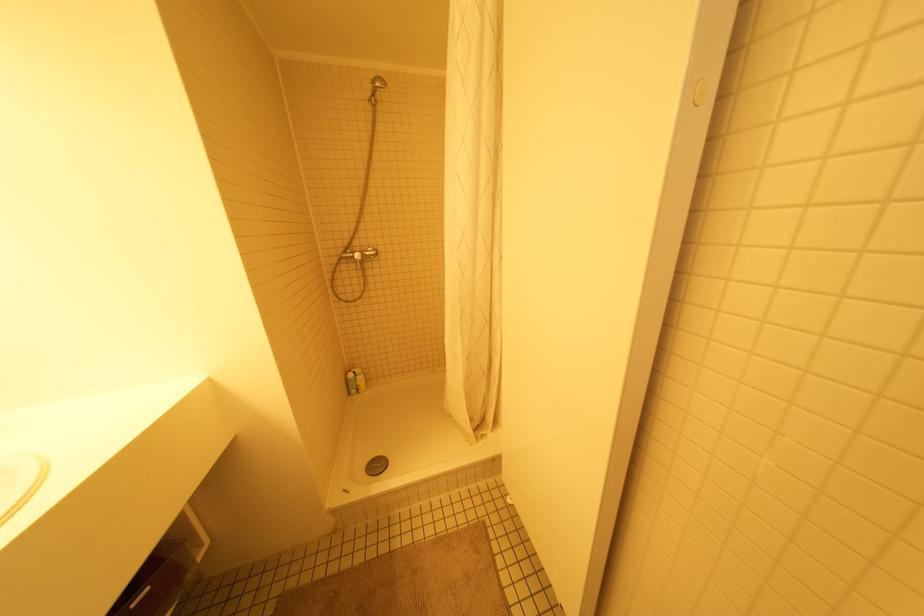
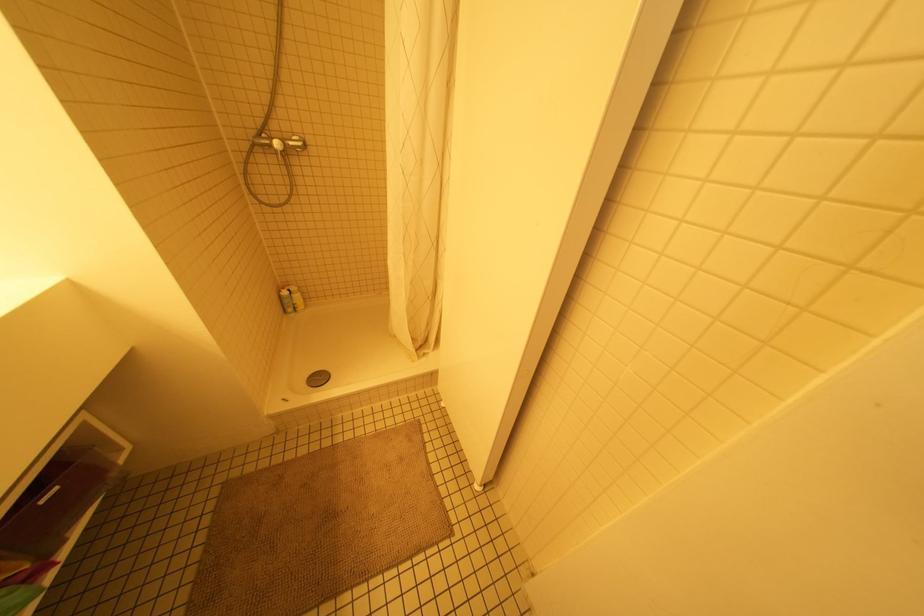
Question: I am providing you with two images of the same scene from different viewpoints. Please identify which objects are invisible in image2.

Choices:
 (A) yellow spray bottle
 (B) round drain cover
 (C) silver faucet lever
 (D) none of these

Answer: (D)